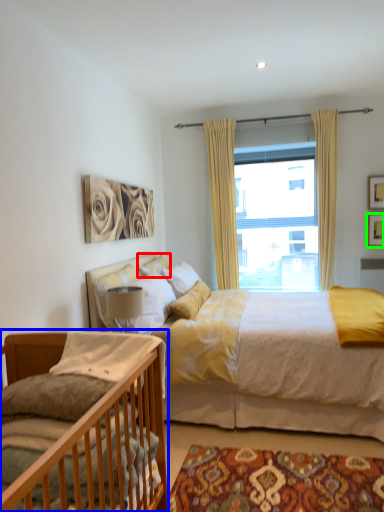
Question: Which is farther away from pillow (highlighted by a red box)? bed (highlighted by a blue box) or picture frame (highlighted by a green box)?

Choices:
 (A) bed
 (B) picture frame

Answer: (B)